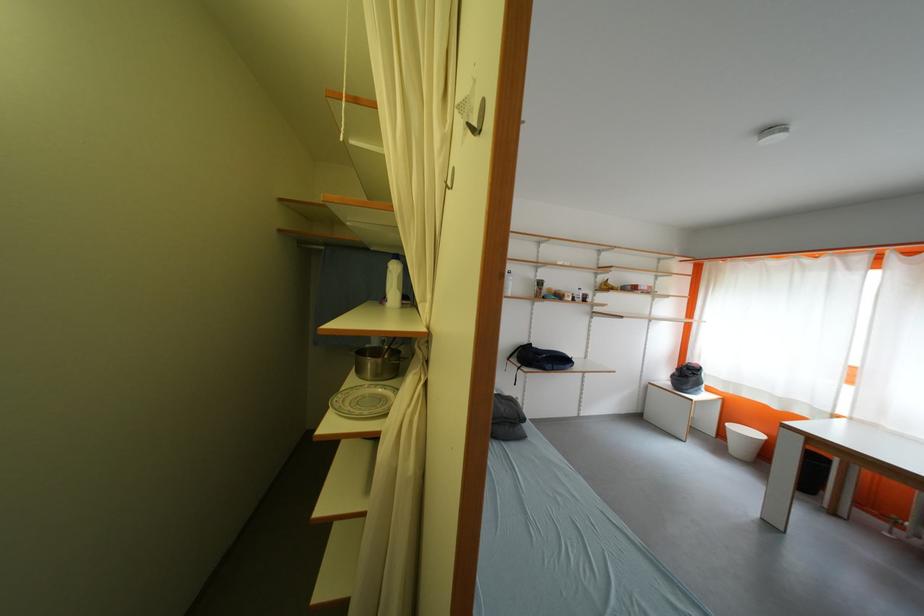
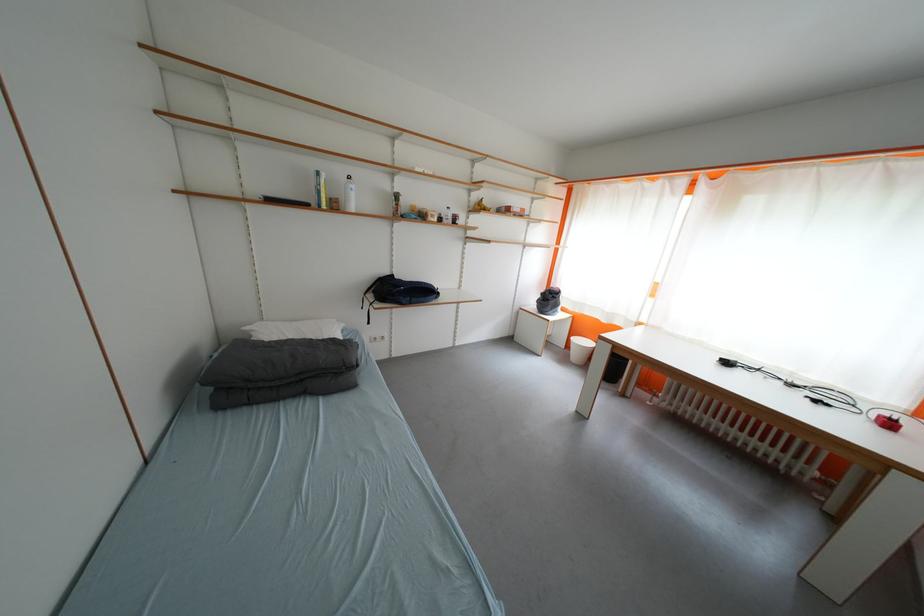
Question: The camera is either moving clockwise (left) or counter-clockwise (right) around the object. The first image is from the beginning of the video and the second image is from the end. Is the camera moving left or right when shooting the video?

Choices:
 (A) Left
 (B) Right

Answer: (A)